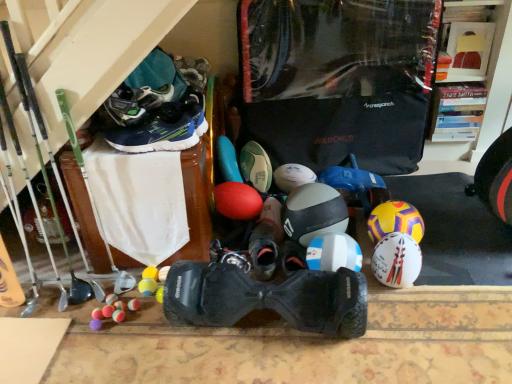
Question: Is black rubber hoverboard at center, positioned as the 1th footwear in front-to-back order, positioned far away from white matte helmet at center, which ranks as the third helmet in left-to-right order?

Choices:
 (A) yes
 (B) no

Answer: (B)

Question: Does black rubber hoverboard at center, positioned as the 1th footwear in front-to-back order, lie behind white matte helmet at center, which ranks as the third helmet in left-to-right order?

Choices:
 (A) yes
 (B) no

Answer: (B)

Question: Does black rubber hoverboard at center, marked as the 5th footwear in a back-to-front arrangement, come in front of white matte helmet at center, the 2th helmet when ordered from right to left?

Choices:
 (A) yes
 (B) no

Answer: (A)

Question: From the image's perspective, is black rubber hoverboard at center, marked as the 5th footwear in a back-to-front arrangement, located above white matte helmet at center, the 2th helmet when ordered from right to left?

Choices:
 (A) no
 (B) yes

Answer: (A)

Question: From a real-world perspective, is black rubber hoverboard at center, positioned as the 1th footwear in front-to-back order, below white matte helmet at center, the 2th helmet when ordered from right to left?

Choices:
 (A) no
 (B) yes

Answer: (A)

Question: Which is correct: dark blue synthetic sneakers at upper left, placed as the second footwear when sorted from front to back, is inside black matte sneaker at center, which is counted as the 4th footwear, starting from the front, or outside of it?

Choices:
 (A) outside
 (B) inside

Answer: (A)

Question: From a real-world perspective, relative to black matte sneaker at center, which is counted as the 4th footwear, starting from the front, is dark blue synthetic sneakers at upper left, placed as the second footwear when sorted from front to back, vertically above or below?

Choices:
 (A) below
 (B) above

Answer: (B)

Question: In the image, is dark blue synthetic sneakers at upper left, the 4th footwear viewed from the back, on the left side or the right side of black matte sneaker at center, which is counted as the 4th footwear, starting from the front?

Choices:
 (A) left
 (B) right

Answer: (A)

Question: Is point (139, 109) closer or farther from the camera than point (263, 220)?

Choices:
 (A) closer
 (B) farther

Answer: (A)

Question: Relative to white matte helmet at right, arranged as the 1th helmet when viewed from the right, is black rubber hoverboard at center, positioned as the 1th footwear in front-to-back order, in front or behind?

Choices:
 (A) front
 (B) behind

Answer: (A)

Question: From a real-world perspective, is black rubber hoverboard at center, marked as the 5th footwear in a back-to-front arrangement, physically located above or below white matte helmet at right, which is the 4th helmet in left-to-right order?

Choices:
 (A) above
 (B) below

Answer: (A)

Question: Looking at the image, does black rubber hoverboard at center, positioned as the 1th footwear in front-to-back order, seem bigger or smaller compared to white matte helmet at right, arranged as the 1th helmet when viewed from the right?

Choices:
 (A) small
 (B) big

Answer: (B)

Question: Visually, is black rubber hoverboard at center, positioned as the 1th footwear in front-to-back order, positioned to the left or to the right of white matte helmet at right, arranged as the 1th helmet when viewed from the right?

Choices:
 (A) right
 (B) left

Answer: (B)

Question: Is green matte soccer ball at center, marked as the 1th footwear in a back-to-front arrangement, inside the boundaries of rubber ball at center, or outside?

Choices:
 (A) inside
 (B) outside

Answer: (B)

Question: Considering the positions of point (258, 185) and point (351, 198), is point (258, 185) closer or farther from the camera than point (351, 198)?

Choices:
 (A) farther
 (B) closer

Answer: (A)